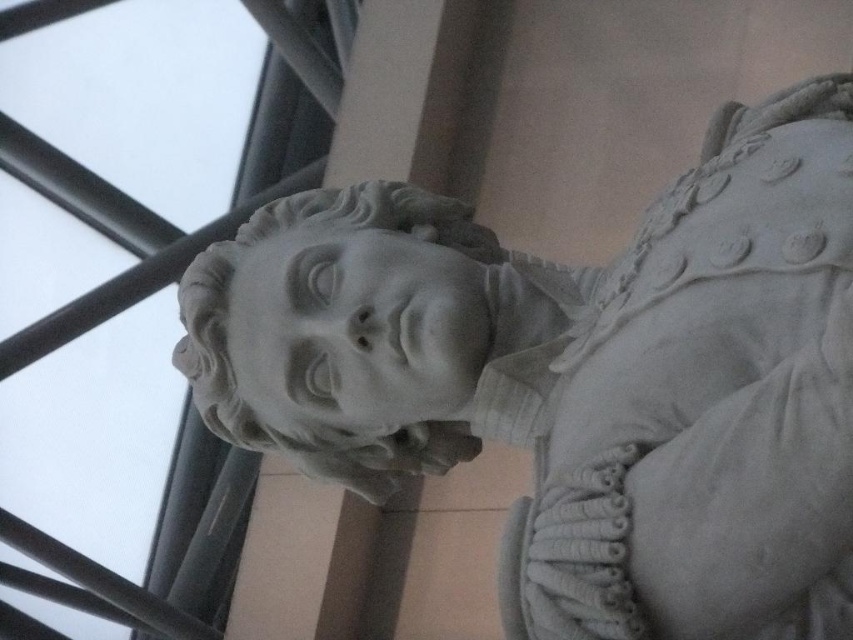
Which of these two, white marble bust at center or white marble head at center, stands shorter?

white marble head at center is shorter.

Is white marble bust at center smaller than white marble head at center?

No.

Is point (834, 99) closer to camera compared to point (358, 264)?

Yes, it is in front of point (358, 264).

Find the location of a particular element. This screenshot has width=853, height=640. white marble bust at center is located at coordinates pos(578,378).